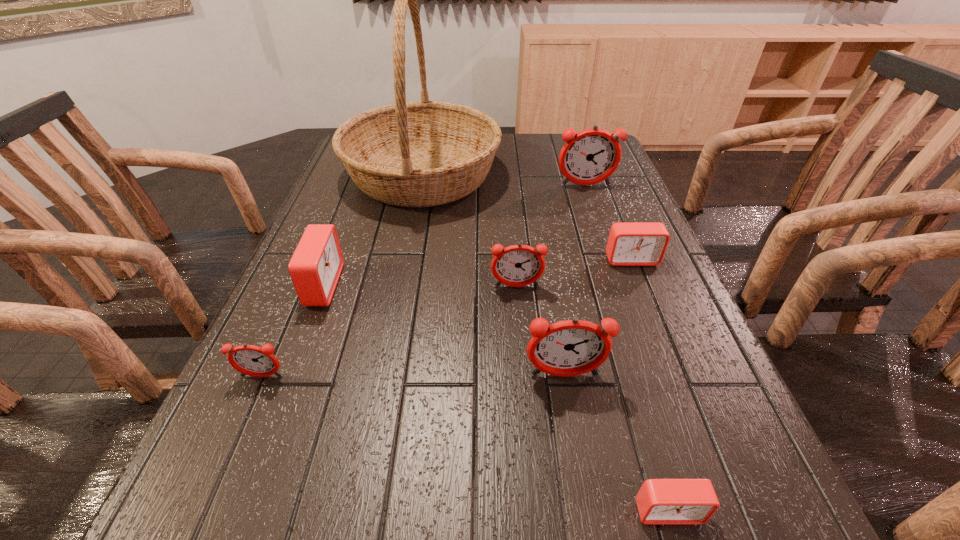
Locate an element on the screen. This screenshot has width=960, height=540. free space between the tallest alarm clock and the biggest red alarm clock is located at coordinates (454, 235).

Find the location of `free space between the sixth shortest alarm clock and the tallest alarm clock`. free space between the sixth shortest alarm clock and the tallest alarm clock is located at coordinates coord(575,281).

You are a GUI agent. You are given a task and a screenshot of the screen. Output one action in this format:
    pyautogui.click(x=<x>, y=<y>)
    Task: Click on the empty location between the basket and the second biggest red alarm clock
    The width and height of the screenshot is (960, 540).
    Given the screenshot: What is the action you would take?
    pyautogui.click(x=527, y=218)

Identify the location of object that can be found as the fifth closest to the nearest alarm clock. This screenshot has height=540, width=960. (315, 267).

Image resolution: width=960 pixels, height=540 pixels. Find the location of `the second closest object to the leftmost reddish-pink alarm clock`. the second closest object to the leftmost reddish-pink alarm clock is located at coordinates (519, 265).

In order to click on the fourth closest alarm clock relative to the biggest reddish-pink alarm clock in this screenshot , I will do coord(573,347).

Point out which alarm clock is positioned as the seventh nearest to the tallest object. Please provide its 2D coordinates. Your answer should be formatted as a tuple, i.e. [(x, y)], where the tuple contains the x and y coordinates of a point satisfying the conditions above.

[(659, 501)]

Locate which reddish-pink alarm clock is the closest to the third biggest reddish-pink alarm clock. Please provide its 2D coordinates. Your answer should be formatted as a tuple, i.e. [(x, y)], where the tuple contains the x and y coordinates of a point satisfying the conditions above.

[(573, 347)]

Locate which reddish-pink alarm clock is the third closest to the leftmost reddish-pink alarm clock. Please provide its 2D coordinates. Your answer should be formatted as a tuple, i.e. [(x, y)], where the tuple contains the x and y coordinates of a point satisfying the conditions above.

[(588, 157)]

Locate an element on the screen. red alarm clock that is the closest to the third biggest reddish-pink alarm clock is located at coordinates (629, 244).